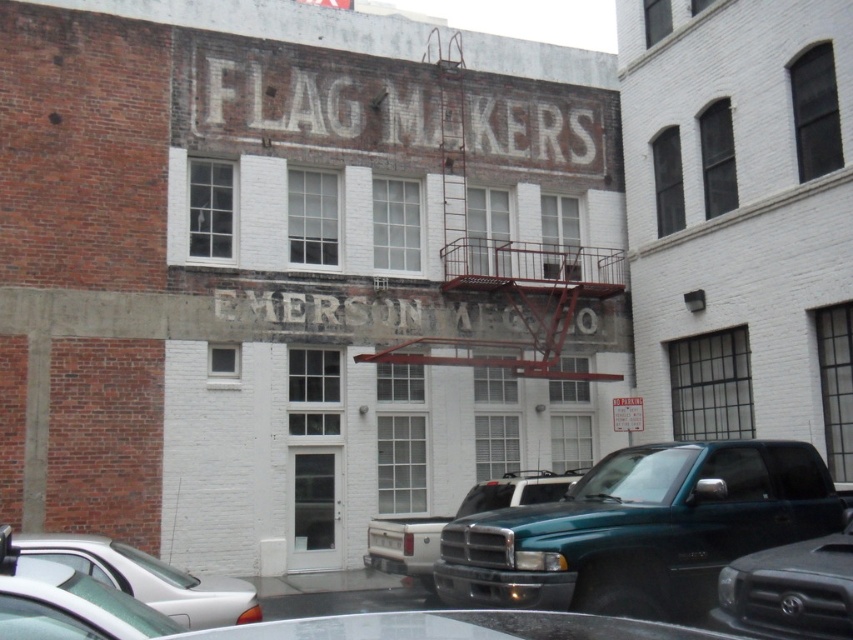
Identify the location of rusty metal fire escape at upper center. (502, 262).

Is point (437, 337) closer to viewer compared to point (234, 620)?

No.

Image resolution: width=853 pixels, height=640 pixels. Find the location of `rusty metal fire escape at upper center`. rusty metal fire escape at upper center is located at coordinates (502, 262).

You are a GUI agent. You are given a task and a screenshot of the screen. Output one action in this format:
    pyautogui.click(x=<x>, y=<y>)
    Task: Click on the teal glossy pickup truck at center
    The height and width of the screenshot is (640, 853).
    Given the screenshot: What is the action you would take?
    pyautogui.click(x=641, y=531)

Who is more forward, (596, 500) or (369, 532)?

Point (596, 500) is in front.

Find the location of `teal glossy pickup truck at center`. teal glossy pickup truck at center is located at coordinates (641, 531).

Does rusty metal fire escape at upper center appear on the left side of teal matte truck at center?

Incorrect, rusty metal fire escape at upper center is not on the left side of teal matte truck at center.

Is point (596, 292) farther from camera compared to point (535, 484)?

Yes.

Is point (581, 244) closer to camera compared to point (496, 496)?

No, (581, 244) is further to viewer.

This screenshot has height=640, width=853. What are the coordinates of `rusty metal fire escape at upper center` in the screenshot? It's located at (502, 262).